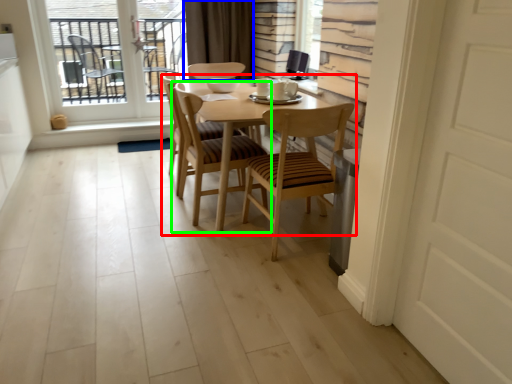
Question: Which is farther away from kitchen & dining room table (highlighted by a red box)? curtain (highlighted by a blue box) or chair (highlighted by a green box)?

Choices:
 (A) curtain
 (B) chair

Answer: (A)